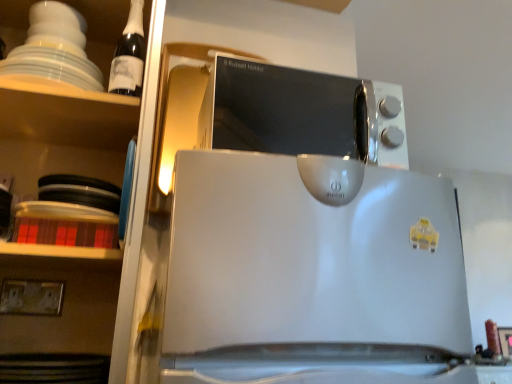
Question: Is white plastic electric outlet at lower left turned away from satin silver microwave at upper center?

Choices:
 (A) no
 (B) yes

Answer: (A)

Question: From a real-world perspective, is white plastic electric outlet at lower left under satin silver microwave at upper center?

Choices:
 (A) yes
 (B) no

Answer: (A)

Question: Is white plastic electric outlet at lower left next to satin silver microwave at upper center and touching it?

Choices:
 (A) no
 (B) yes

Answer: (A)

Question: Is there a large distance between white plastic electric outlet at lower left and satin silver microwave at upper center?

Choices:
 (A) yes
 (B) no

Answer: (A)

Question: Is white plastic electric outlet at lower left at the right side of satin silver microwave at upper center?

Choices:
 (A) no
 (B) yes

Answer: (A)

Question: Is white plastic electric outlet at lower left further to camera compared to satin silver microwave at upper center?

Choices:
 (A) no
 (B) yes

Answer: (B)

Question: From the image's perspective, does dark glass bottle at upper left appear lower than white glossy shelves at upper left?

Choices:
 (A) yes
 (B) no

Answer: (B)

Question: Is dark glass bottle at upper left in contact with white glossy shelves at upper left?

Choices:
 (A) no
 (B) yes

Answer: (A)

Question: Can you confirm if dark glass bottle at upper left is smaller than white glossy shelves at upper left?

Choices:
 (A) no
 (B) yes

Answer: (B)

Question: Does dark glass bottle at upper left lie behind white glossy shelves at upper left?

Choices:
 (A) no
 (B) yes

Answer: (B)

Question: Could you tell me if dark glass bottle at upper left is turned towards white glossy shelves at upper left?

Choices:
 (A) yes
 (B) no

Answer: (A)

Question: From the image's perspective, does dark glass bottle at upper left appear higher than white glossy shelves at upper left?

Choices:
 (A) no
 (B) yes

Answer: (B)

Question: Does white glossy shelves at upper left contain white plastic electric outlet at lower left?

Choices:
 (A) no
 (B) yes

Answer: (B)